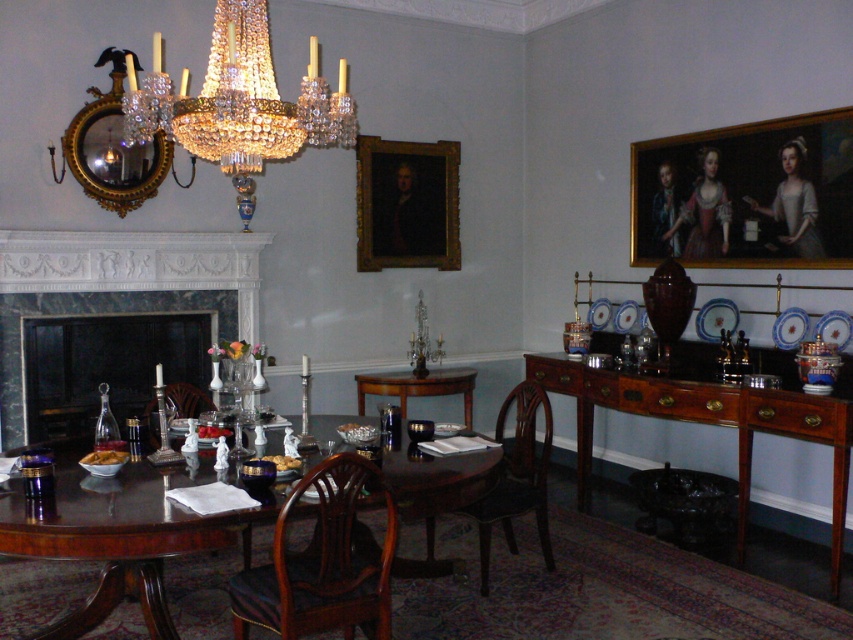
Can you confirm if mahogany wood round table at center is positioned below brown wood chair at lower center?

No, mahogany wood round table at center is not below brown wood chair at lower center.

Can you confirm if mahogany wood round table at center is bigger than brown wood chair at lower center?

Indeed, mahogany wood round table at center has a larger size compared to brown wood chair at lower center.

Where is `mahogany wood round table at center`? mahogany wood round table at center is located at coordinates (120, 536).

Between marble fireplace at center and wooden chair at table left, which one appears on the right side from the viewer's perspective?

Positioned to the right is wooden chair at table left.

Looking at this image, is marble fireplace at center smaller than wooden chair at table left?

Incorrect, marble fireplace at center is not smaller in size than wooden chair at table left.

Measure the distance between marble fireplace at center and camera.

A distance of 4.59 meters exists between marble fireplace at center and camera.

This screenshot has height=640, width=853. Find the location of `marble fireplace at center`. marble fireplace at center is located at coordinates (119, 288).

Between marble fireplace at center and mahogany wood chair at center, which one has less height?

Standing shorter between the two is mahogany wood chair at center.

Is point (96, 259) positioned in front of point (553, 566)?

No, it is behind (553, 566).

Is point (248, 250) positioned in front of point (505, 404)?

Yes, it is in front of point (505, 404).

At what (x,y) coordinates should I click in order to perform the action: click on marble fireplace at center. Please return your answer as a coordinate pair (x, y). Looking at the image, I should click on (119, 288).